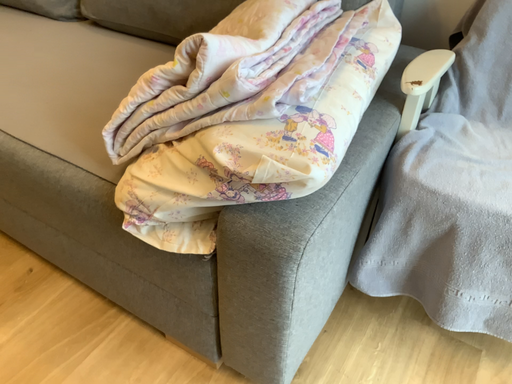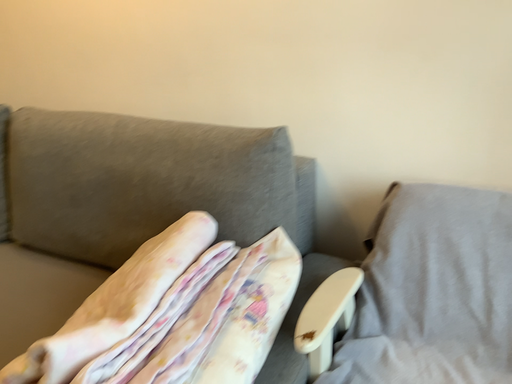
Question: Which way did the camera rotate in the video?

Choices:
 (A) rotated upward
 (B) rotated downward

Answer: (A)